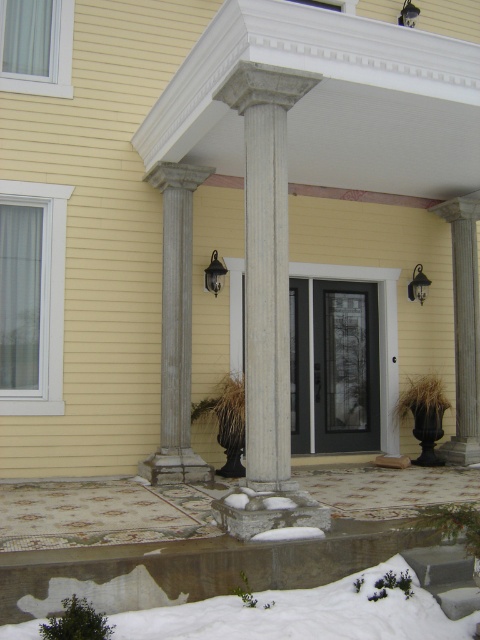
Which is more to the left, white fluffy snow at lower center or black matte wall sconce at upper center?

From the viewer's perspective, black matte wall sconce at upper center appears more on the left side.

Image resolution: width=480 pixels, height=640 pixels. Find the location of `white fluffy snow at lower center`. white fluffy snow at lower center is located at coordinates (303, 614).

Is gray concrete column at right bigger than metallic black lamp at upper center?

Yes, gray concrete column at right is bigger than metallic black lamp at upper center.

In the scene shown: How far apart are gray concrete column at right and metallic black lamp at upper center?

gray concrete column at right is 3.77 meters away from metallic black lamp at upper center.

Where is `gray concrete column at right`? This screenshot has width=480, height=640. gray concrete column at right is located at coordinates (464, 326).

Does black matte wall sconce at upper center have a greater height compared to metallic gray wall sconce at upper right?

Indeed, black matte wall sconce at upper center has a greater height compared to metallic gray wall sconce at upper right.

This screenshot has height=640, width=480. I want to click on black matte wall sconce at upper center, so click(215, 275).